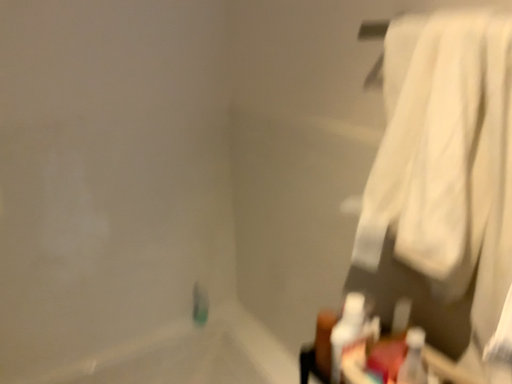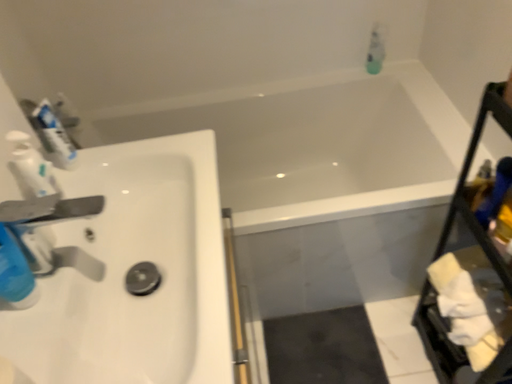
Question: How did the camera likely rotate when shooting the video?

Choices:
 (A) rotated right
 (B) rotated left

Answer: (B)